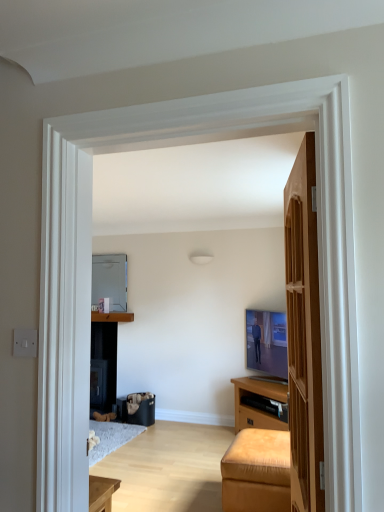
What is the approximate height of metallic refrigerator at center?

metallic refrigerator at center is 28.28 inches in height.

Where is `wooden door at right`? wooden door at right is located at coordinates (304, 332).

Describe the element at coordinates (257, 472) in the screenshot. I see `leather ottoman at lower right` at that location.

This screenshot has height=512, width=384. What do you see at coordinates (111, 317) in the screenshot?
I see `matte brown cabinet at center` at bounding box center [111, 317].

Identify the location of metallic refrigerator at center. (110, 280).

From the image's perspective, is metallic refrigerator at center above or below leather ottoman at lower right?

metallic refrigerator at center is situated higher than leather ottoman at lower right in the image.

Is metallic refrigerator at center looking in the opposite direction of leather ottoman at lower right?

No.

Can you confirm if metallic refrigerator at center is bigger than leather ottoman at lower right?

Incorrect, metallic refrigerator at center is not larger than leather ottoman at lower right.

Is metallic refrigerator at center at the left side of leather ottoman at lower right?

Yes.

Is point (124, 261) positioned after point (297, 509)?

Yes, it is.

Considering the positions of objects metallic refrigerator at center and wooden door at right in the image provided, who is more to the right, metallic refrigerator at center or wooden door at right?

From the viewer's perspective, wooden door at right appears more on the right side.

Is the depth of metallic refrigerator at center less than that of wooden door at right?

No, the depth of metallic refrigerator at center is greater than that of wooden door at right.

In the scene shown: Can you confirm if matte brown cabinet at center is taller than metallic refrigerator at center?

No.

Would you say matte brown cabinet at center contains metallic refrigerator at center?

That's incorrect, metallic refrigerator at center is not inside matte brown cabinet at center.

Can you confirm if matte brown cabinet at center is bigger than metallic refrigerator at center?

No.

Is matte brown cabinet at center positioned with its back to metallic refrigerator at center?

No.

From a real-world perspective, who is located higher, leather ottoman at lower right or metallic refrigerator at center?

metallic refrigerator at center is physically above.

In the scene shown: Does leather ottoman at lower right come behind metallic refrigerator at center?

No.

Is leather ottoman at lower right oriented towards metallic refrigerator at center?

No.

How far apart are leather ottoman at lower right and metallic refrigerator at center?

The distance of leather ottoman at lower right from metallic refrigerator at center is 2.75 meters.

In the scene shown: From the image's perspective, which one is positioned higher, wooden door at right or leather ottoman at lower right?

wooden door at right is shown above in the image.

Would you say wooden door at right is outside leather ottoman at lower right?

Yes, wooden door at right is outside of leather ottoman at lower right.

From a real-world perspective, is wooden door at right physically above leather ottoman at lower right?

Yes.

From a real-world perspective, which object stands above the other?

metallic refrigerator at center.

Would you say wooden door at right is inside or outside metallic refrigerator at center?

wooden door at right is spatially situated outside metallic refrigerator at center.

From the image's perspective, is wooden door at right on metallic refrigerator at center?

No.

Considering the relative sizes of wooden door at right and metallic refrigerator at center in the image provided, is wooden door at right wider than metallic refrigerator at center?

Indeed, wooden door at right has a greater width compared to metallic refrigerator at center.

From a real-world perspective, which is physically below, matte brown cabinet at center or leather ottoman at lower right?

leather ottoman at lower right, from a real-world perspective.

Is matte brown cabinet at center bigger than leather ottoman at lower right?

No.

Identify the location of cabinetry lying behind the leather ottoman at lower right. (111, 317).

Is there a large distance between matte brown cabinet at center and leather ottoman at lower right?

Yes, matte brown cabinet at center and leather ottoman at lower right are located far from each other.

The image size is (384, 512). What are the coordinates of `furniture below the metallic refrigerator at center (from the image's perspective)` in the screenshot? It's located at (257, 472).

Where is `door that appears below the metallic refrigerator at center (from a real-world perspective)`? Image resolution: width=384 pixels, height=512 pixels. door that appears below the metallic refrigerator at center (from a real-world perspective) is located at coordinates (304, 332).

Considering their positions, is wooden door at right positioned further to leather ottoman at lower right than matte brown cabinet at center?

matte brown cabinet at center is further to leather ottoman at lower right.

Considering their positions, is leather ottoman at lower right positioned further to metallic refrigerator at center than wooden door at right?

Among the two, wooden door at right is located further to metallic refrigerator at center.

Based on their spatial positions, is metallic refrigerator at center or leather ottoman at lower right closer to wooden door at right?

leather ottoman at lower right lies closer to wooden door at right than the other object.

When comparing their distances from matte brown cabinet at center, does metallic refrigerator at center or leather ottoman at lower right seem closer?

metallic refrigerator at center is closer to matte brown cabinet at center.

When comparing their distances from metallic refrigerator at center, does leather ottoman at lower right or matte brown cabinet at center seem further?

leather ottoman at lower right is further to metallic refrigerator at center.

From the image, which object appears to be farther from metallic refrigerator at center, matte brown cabinet at center or leather ottoman at lower right?

leather ottoman at lower right is positioned further to the anchor metallic refrigerator at center.

Based on their spatial positions, is matte brown cabinet at center or leather ottoman at lower right closer to wooden door at right?

Based on the image, leather ottoman at lower right appears to be nearer to wooden door at right.

Based on their spatial positions, is wooden door at right or leather ottoman at lower right further from matte brown cabinet at center?

wooden door at right lies further to matte brown cabinet at center than the other object.

Image resolution: width=384 pixels, height=512 pixels. What are the coordinates of `cabinetry positioned between wooden door at right and metallic refrigerator at center from near to far` in the screenshot? It's located at click(111, 317).

The height and width of the screenshot is (512, 384). Identify the location of furniture between wooden door at right and matte brown cabinet at center along the z-axis. pos(257,472).

This screenshot has height=512, width=384. Identify the location of furniture between wooden door at right and metallic refrigerator at center along the z-axis. (257, 472).

You are a GUI agent. You are given a task and a screenshot of the screen. Output one action in this format:
    pyautogui.click(x=<x>, y=<y>)
    Task: Click on the cabinetry between leather ottoman at lower right and metallic refrigerator at center along the z-axis
    The image size is (384, 512).
    Given the screenshot: What is the action you would take?
    pyautogui.click(x=111, y=317)